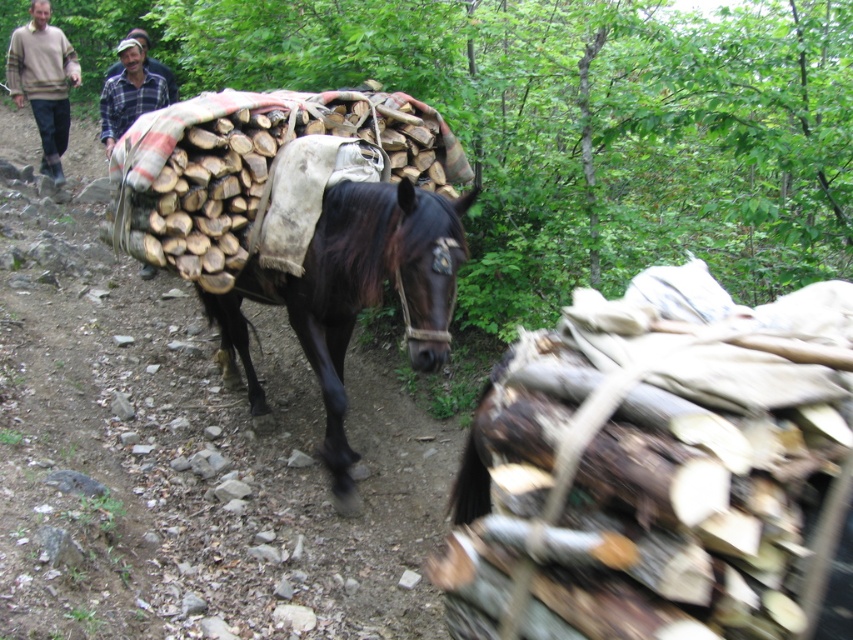
You are a photographer trying to capture the shiny dark brown horse at center and the beige sweater at upper left in the same frame. Which object should you focus on first if you want to ensure both are in focus without moving the camera?

You should focus on the shiny dark brown horse at center first because it is wider than the beige sweater at upper left, so focusing on the wider object will increase the chances of both being in focus.

You are standing at the point labeled point (461, 180) and want to walk towards the point labeled point (9, 90). Based on the scene, will you be moving towards the background or the foreground?

You will be moving towards the background because point (461, 180) is closer to the camera than point (9, 90). Since you start closer to the camera and move away from it, you are heading toward the background.

You are a hiker who wants to take a photo of the wooden logs at center and the beige sweater at upper left. Which object should you focus on first if you want to capture both in one frame without moving the camera?

You should focus on the wooden logs at center first because it is located below the beige sweater at upper left, so adjusting the focus to the lower area will help include both in the frame.